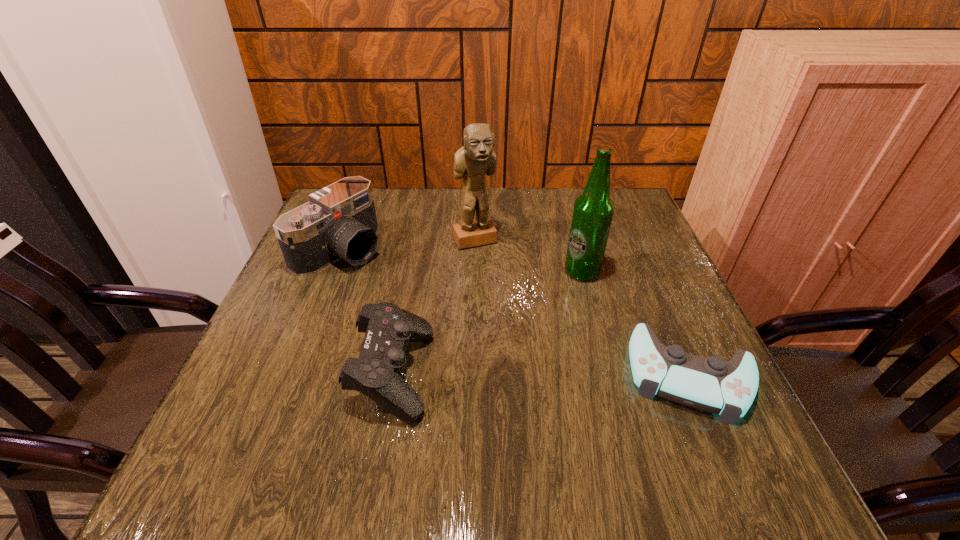
Find the location of a particular element. This screenshot has width=960, height=540. free spot on the desktop that is between the left control and the shorter control and is positioned on the front-facing side of the third shortest object is located at coordinates (557, 374).

Where is `vacant space on the desktop that is between the second object from left to right and the shortest object and is positioned on the front-facing side of the figurine`? vacant space on the desktop that is between the second object from left to right and the shortest object and is positioned on the front-facing side of the figurine is located at coordinates (552, 374).

Locate an element on the screen. vacant space on the desktop that is between the second object from left to right and the shortest object and is positioned on the label of the beer bottle is located at coordinates (567, 374).